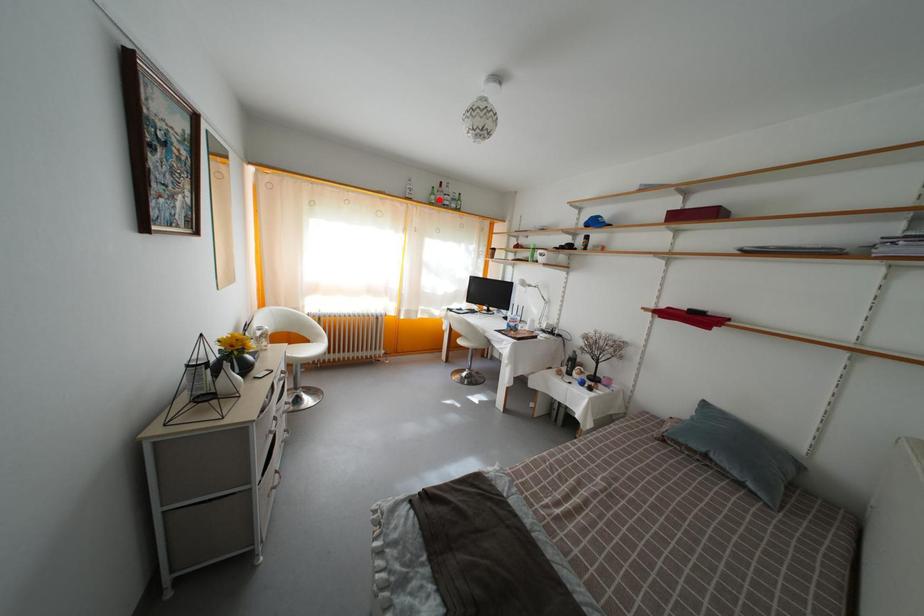
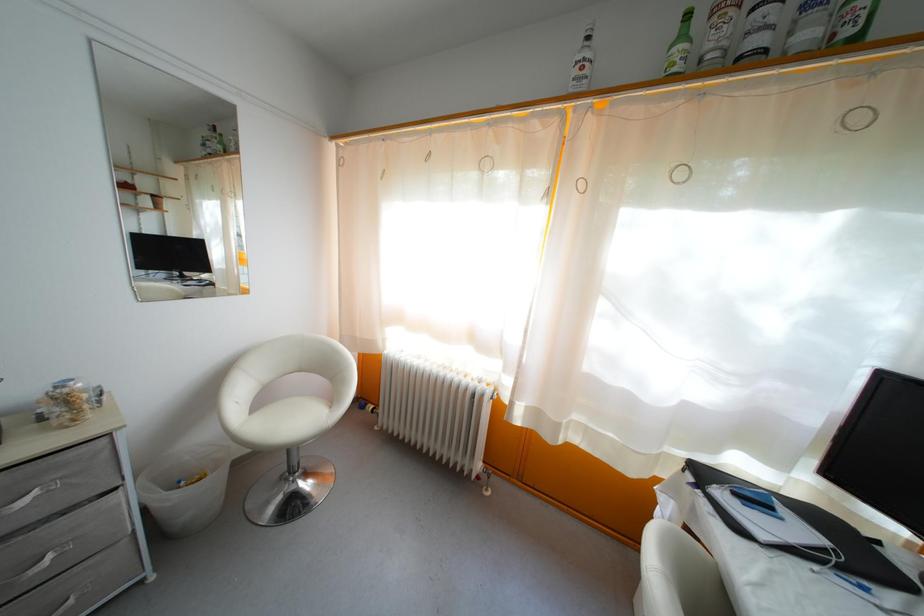
Locate, in the second image, the point that corresponds to the highlighted location in the first image.

(688, 43)